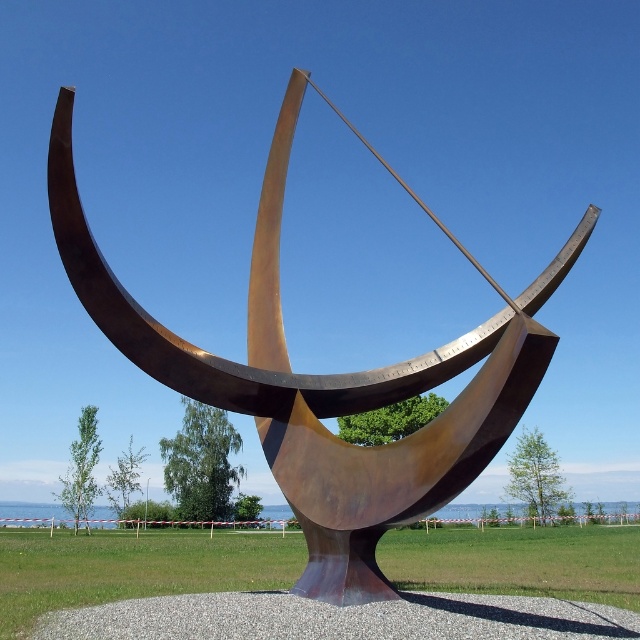
Question: Is rusty metal sundial at center bigger than gray gravel at center?

Choices:
 (A) yes
 (B) no

Answer: (A)

Question: Does rusty metal sundial at center have a smaller size compared to gray gravel at center?

Choices:
 (A) yes
 (B) no

Answer: (B)

Question: Which object appears farthest from the camera in this image?

Choices:
 (A) rusty metal sundial at center
 (B) gray gravel at center

Answer: (A)

Question: Can you confirm if rusty metal sundial at center is wider than gray gravel at center?

Choices:
 (A) no
 (B) yes

Answer: (A)